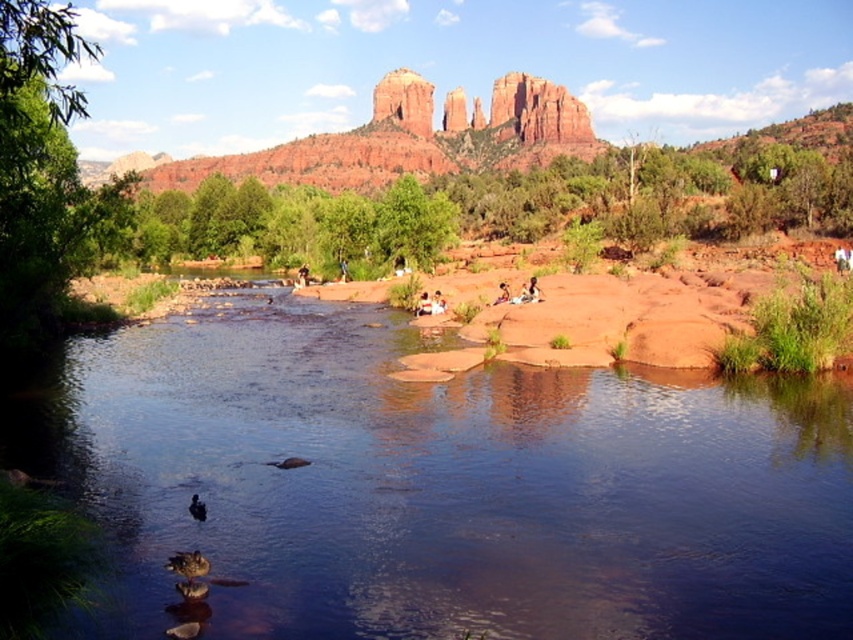
Question: Does clear water at center have a larger size compared to smooth skin person at center?

Choices:
 (A) yes
 (B) no

Answer: (A)

Question: Estimate the real-world distances between objects in this image. Which object is farther from the clear water at center?

Choices:
 (A) smooth skin person at center
 (B) reddish-brown rock formation at center

Answer: (B)

Question: Which of the following is the farthest from the observer?

Choices:
 (A) smooth skin person at center
 (B) reddish-brown rock formation at center

Answer: (B)

Question: Is reddish-brown rock formation at center closer to camera compared to smooth skin person at center?

Choices:
 (A) no
 (B) yes

Answer: (A)

Question: Can you confirm if reddish-brown rock formation at center is positioned above smooth skin person at center?

Choices:
 (A) no
 (B) yes

Answer: (B)

Question: Based on their relative distances, which object is farther from the smooth skin person at center?

Choices:
 (A) reddish-brown rock formation at center
 (B) clear water at center

Answer: (A)